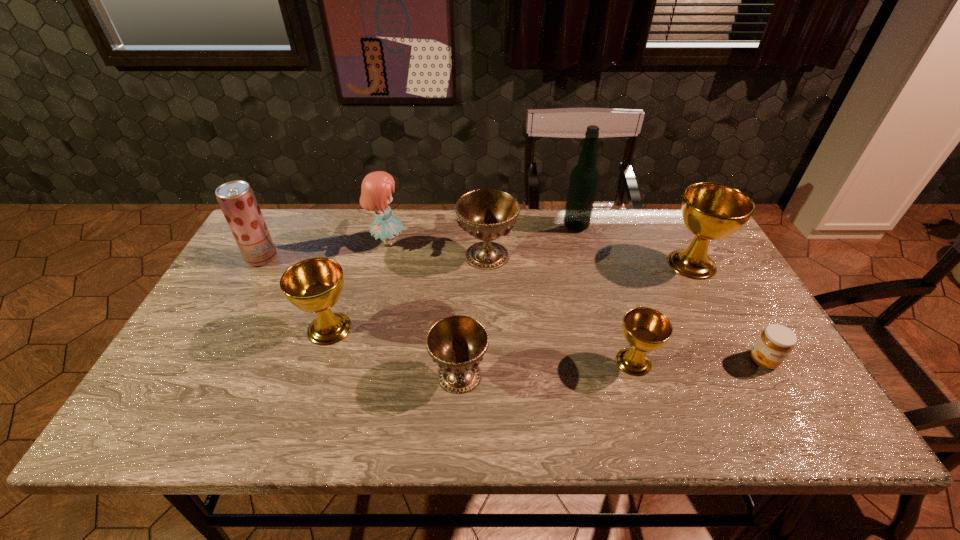
Find the location of a particular element. This screenshot has height=540, width=960. the eighth closest object to the smaller red chalice is located at coordinates (775, 343).

This screenshot has width=960, height=540. Find the location of `chalice that stands as the second closest to the rightmost chalice`. chalice that stands as the second closest to the rightmost chalice is located at coordinates (487, 214).

At what (x,y) coordinates should I click in order to perform the action: click on chalice that stands as the second closest to the second biggest gold chalice. Please return your answer as a coordinate pair (x, y). Looking at the image, I should click on (487, 214).

This screenshot has height=540, width=960. In order to click on gold chalice that is the second closest to the smaller red chalice in this screenshot , I will do `click(645, 329)`.

Locate which gold chalice ranks second in proximity to the leftmost gold chalice. Please provide its 2D coordinates. Your answer should be formatted as a tuple, i.e. [(x, y)], where the tuple contains the x and y coordinates of a point satisfying the conditions above.

[(711, 211)]

What are the coordinates of `vacant area in the image that satisfies the following two spatial constraints: 1. on the front-facing side of the bigger red chalice; 2. on the left side of the blue doll` in the screenshot? It's located at (385, 255).

What are the coordinates of `free spot that satisfies the following two spatial constraints: 1. on the back side of the tallest object; 2. on the right side of the leftmost gold chalice` in the screenshot? It's located at (363, 226).

At what (x,y) coordinates should I click in order to perform the action: click on vacant space that satisfies the following two spatial constraints: 1. on the back side of the smaller red chalice; 2. on the front-facing side of the doll. Please return your answer as a coordinate pair (x, y). The width and height of the screenshot is (960, 540). Looking at the image, I should click on (465, 242).